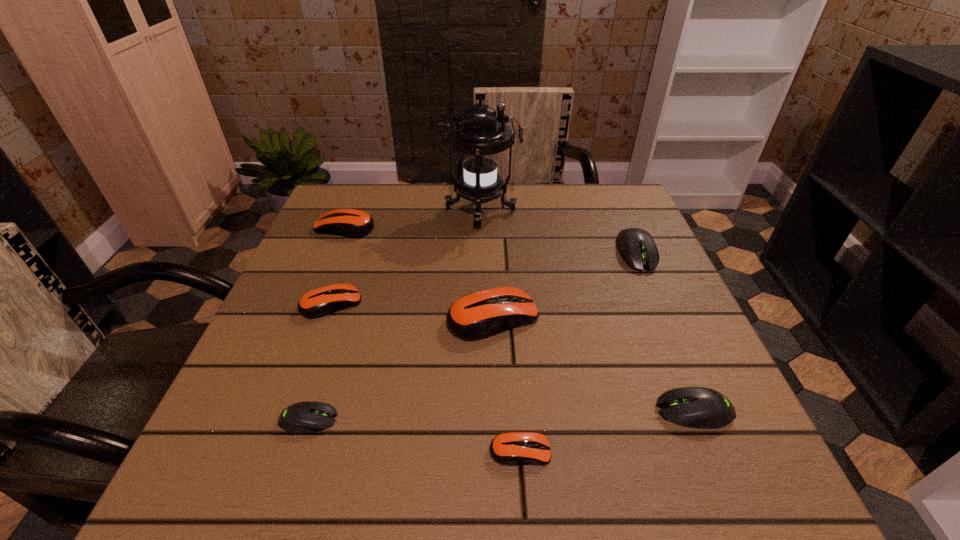
This screenshot has height=540, width=960. Identify the location of vacant area situated on the left of the tallest object. (360, 211).

Where is `free space located 0.340m on the left of the biggest orange computer mouse`? This screenshot has height=540, width=960. free space located 0.340m on the left of the biggest orange computer mouse is located at coordinates (272, 317).

You are a GUI agent. You are given a task and a screenshot of the screen. Output one action in this format:
    pyautogui.click(x=<x>, y=<y>)
    Task: Click on the vacant space located on the wheel side of the farthest gray computer mouse
    The width and height of the screenshot is (960, 540).
    Given the screenshot: What is the action you would take?
    pyautogui.click(x=661, y=310)

The image size is (960, 540). Identify the location of vacant space situated on the right of the farthest orange computer mouse. (527, 227).

Image resolution: width=960 pixels, height=540 pixels. Identify the location of blank space located 0.050m on the wheel side of the second biggest gray computer mouse. (625, 411).

Where is `vacant point located 0.090m on the wheel side of the second biggest gray computer mouse`? The width and height of the screenshot is (960, 540). vacant point located 0.090m on the wheel side of the second biggest gray computer mouse is located at coordinates (599, 411).

Where is `vacant space located 0.260m on the wheel side of the second biggest gray computer mouse`? This screenshot has height=540, width=960. vacant space located 0.260m on the wheel side of the second biggest gray computer mouse is located at coordinates (492, 411).

I want to click on blank space located on the right of the second smallest orange computer mouse, so coord(406,303).

Locate an element on the screen. vacant space situated 0.360m on the wheel side of the smallest gray computer mouse is located at coordinates (569, 420).

What are the coordinates of `blank area located 0.060m on the left of the nearest object` in the screenshot? It's located at (448, 451).